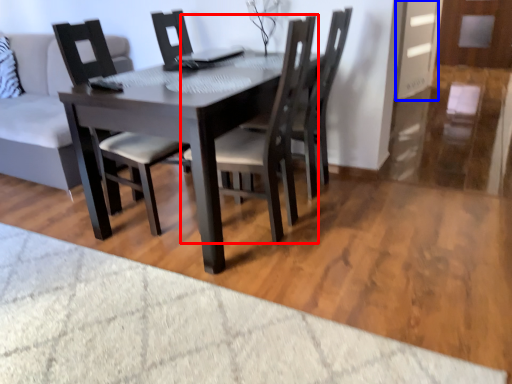
Question: Which of the following is the closest to the observer, chair (highlighted by a red box) or glass door (highlighted by a blue box)?

Choices:
 (A) chair
 (B) glass door

Answer: (A)